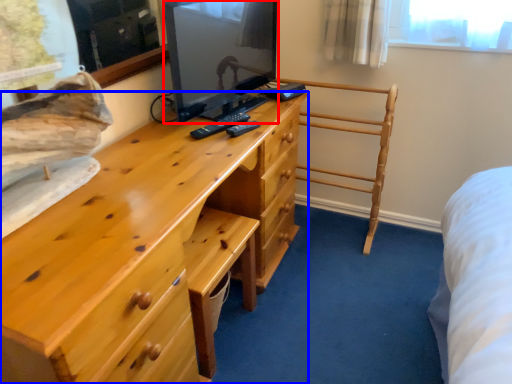
Question: Which object appears closest to the camera in this image, television (highlighted by a red box) or chest of drawers (highlighted by a blue box)?

Choices:
 (A) television
 (B) chest of drawers

Answer: (B)